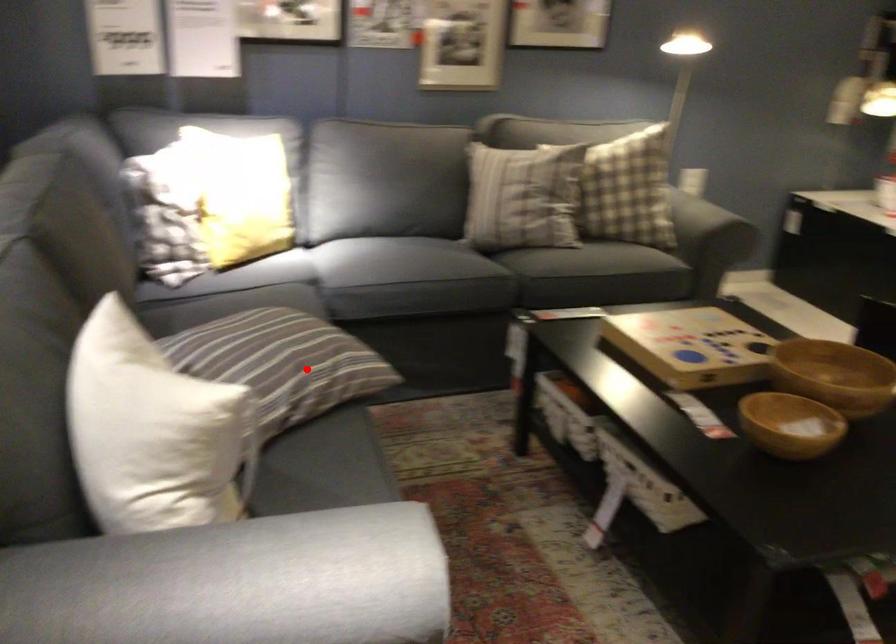
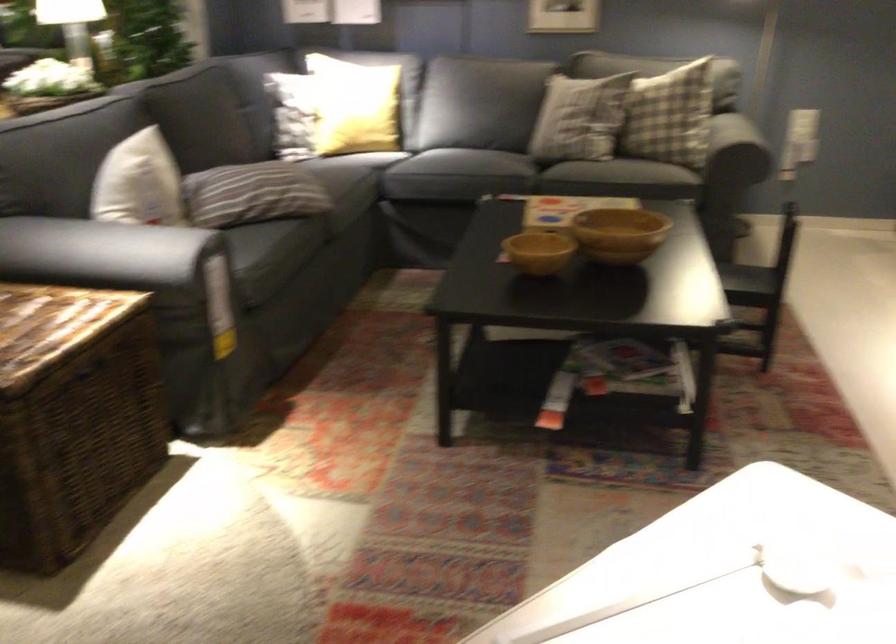
Find the pixel in the second image that matches the highlighted location in the first image.

(261, 194)